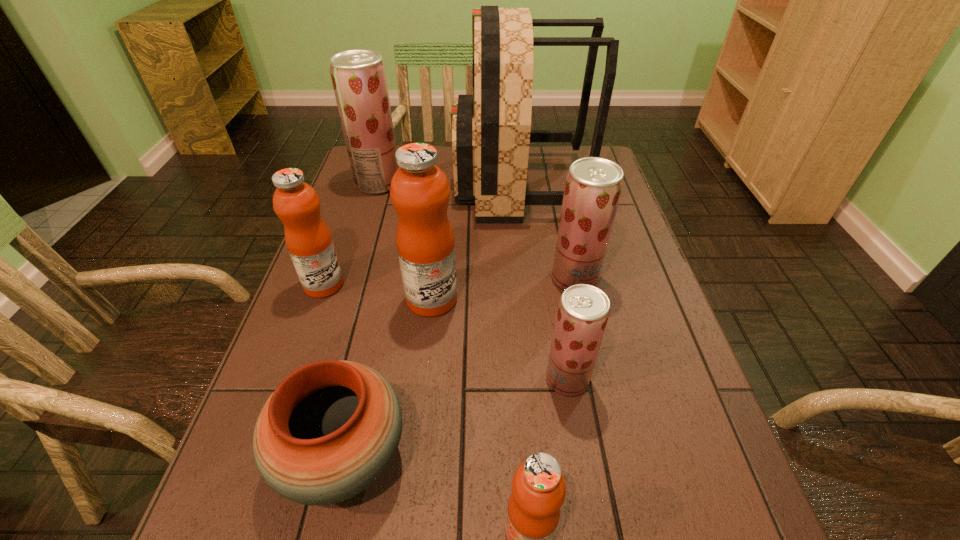
What are the coordinates of `backpack` in the screenshot? It's located at tap(491, 130).

Find the location of `the leftmost strawberry fruit juice`. the leftmost strawberry fruit juice is located at coordinates (358, 76).

Find the location of `the farthest fruit juice`. the farthest fruit juice is located at coordinates (358, 76).

I want to click on the biggest orange fruit juice, so click(x=420, y=192).

Locate an element on the screen. This screenshot has width=960, height=540. the third fruit juice from left to right is located at coordinates (420, 192).

Locate an element on the screen. This screenshot has width=960, height=540. the second smallest strawberry fruit juice is located at coordinates (593, 186).

Identify the location of the second biggest orange fruit juice. (308, 239).

Locate an element on the screen. The height and width of the screenshot is (540, 960). the fifth farthest fruit juice is located at coordinates (583, 310).

This screenshot has height=540, width=960. Find the location of `the nearest strawberry fruit juice`. the nearest strawberry fruit juice is located at coordinates (583, 310).

Locate an element on the screen. This screenshot has height=540, width=960. red pottery is located at coordinates (331, 428).